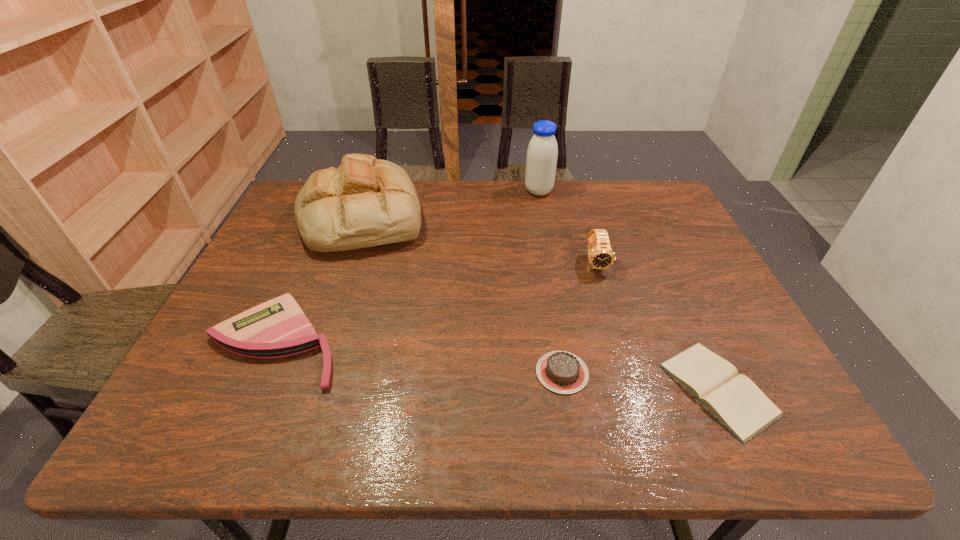
Locate an element on the screen. vacant area that lies between the bread and the third tallest object is located at coordinates (479, 240).

This screenshot has width=960, height=540. I want to click on free point between the rightmost object and the watch, so click(x=657, y=326).

You are a GUI agent. You are given a task and a screenshot of the screen. Output one action in this format:
    pyautogui.click(x=<x>, y=<y>)
    Task: Click on the vacant region between the bread and the soya milk
    
    Given the screenshot: What is the action you would take?
    pyautogui.click(x=450, y=204)

You are a GUI agent. You are given a task and a screenshot of the screen. Output one action in this format:
    pyautogui.click(x=<x>, y=<y>)
    Task: Click on the empty space that is in between the tallest object and the third tallest object
    This screenshot has width=960, height=540.
    Given the screenshot: What is the action you would take?
    click(567, 227)

Find the location of `vacant region between the wristlet and the fifth tallest object`. vacant region between the wristlet and the fifth tallest object is located at coordinates (419, 357).

Locate an element on the screen. Image resolution: width=960 pixels, height=540 pixels. unoccupied position between the Bible and the fifth object from left to right is located at coordinates (657, 326).

Locate an element on the screen. vacant space in between the fifth object from left to right and the tallest object is located at coordinates (567, 227).

Locate an element on the screen. empty location between the tallest object and the third shortest object is located at coordinates (407, 267).

I want to click on free space between the fifth shortest object and the soya milk, so click(x=450, y=204).

Locate an element on the screen. This screenshot has height=540, width=960. object that can be found as the fifth closest to the tallest object is located at coordinates (277, 328).